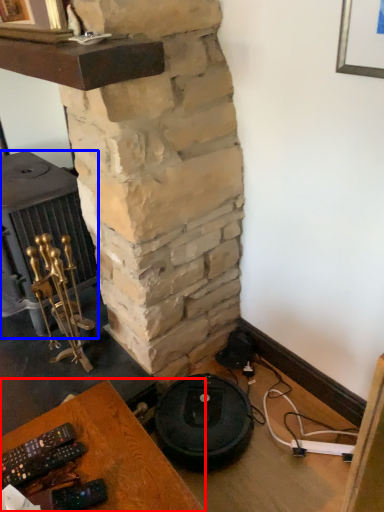
Question: Which object is further to the camera taking this photo, furniture (highlighted by a red box) or stove (highlighted by a blue box)?

Choices:
 (A) furniture
 (B) stove

Answer: (B)